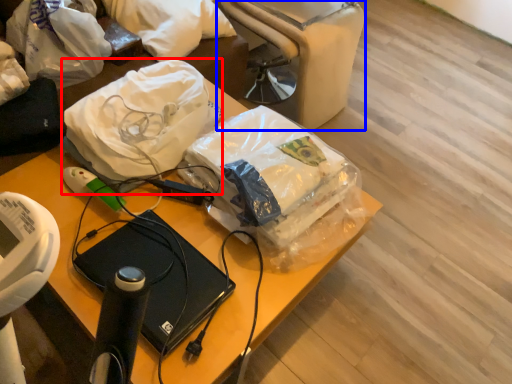
Question: Which object appears farthest to the camera in this image, plastic bag (highlighted by a red box) or bean bag chair (highlighted by a blue box)?

Choices:
 (A) plastic bag
 (B) bean bag chair

Answer: (B)